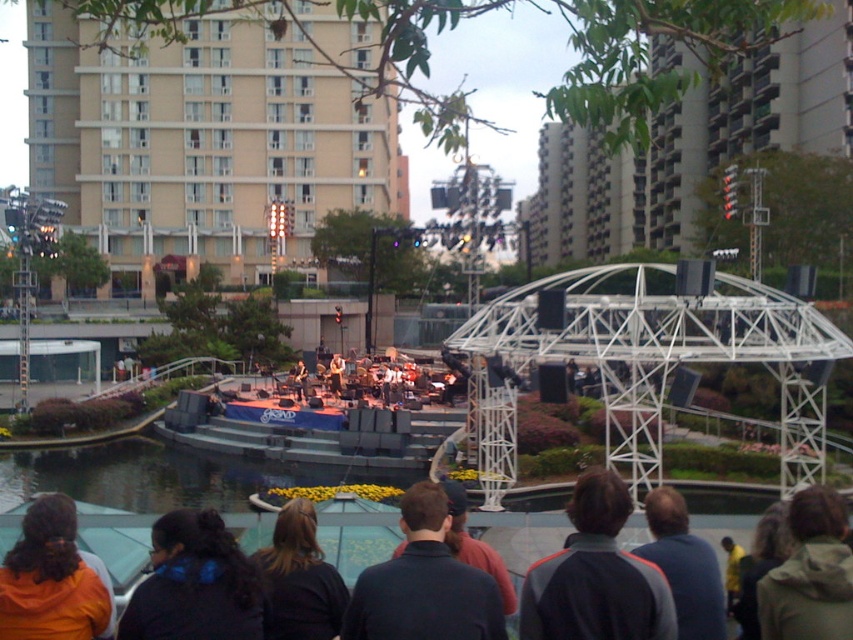
From the picture: You are a photographer at the concert and want to capture both the dark blue shirt at center and the green fuzzy jacket at lower right in the same frame. Which clothing item should you focus on first to ensure both are in focus?

The dark blue shirt at center is shorter than the green fuzzy jacket at lower right, so focusing on the green fuzzy jacket at lower right first will help ensure both are in focus since it is taller and might be further away.

You are a photographer at the concert and want to capture a photo of the stage. You notice the black fabric at center and orange fleece jacket at lower left in your frame. Which object should you focus on first if you want to prioritize the one closer to the camera?

The orange fleece jacket at lower left is closer to the camera than the black fabric at center, so you should focus on the orange fleece jacket at lower left first.